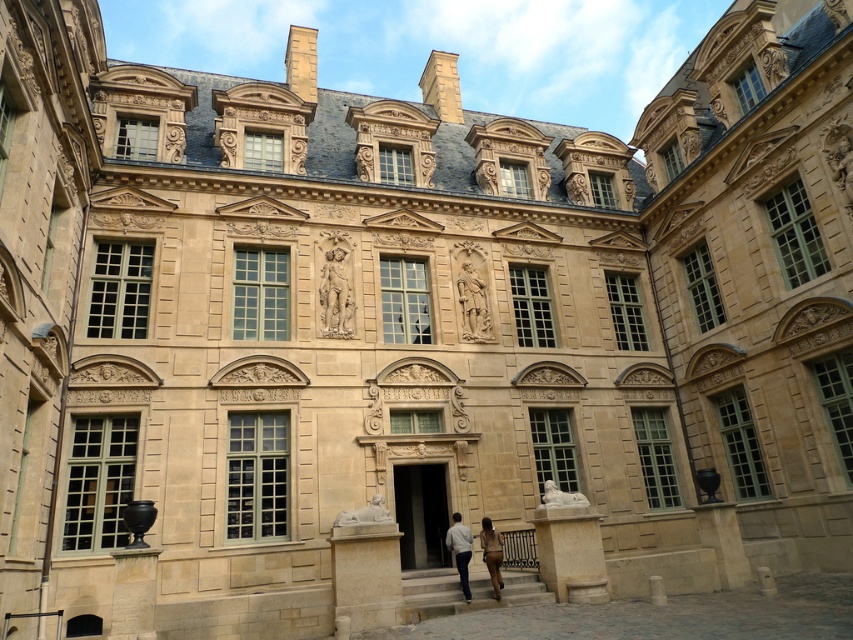
You are an artist standing in front of the grand historical building. You notice a white cotton shirt at center and brown leather pants at center. Which object is shorter?

The white cotton shirt at center is shorter than the brown leather pants at center.

You are standing in front of a historical building with a white cotton shirt at center. Where is the white cotton shirt located in relation to the building?

The white cotton shirt at center is located at point 0.861 on the x axis and 0.540 on the y axis relative to the building.

You are a fashion designer who needs to create a cohesive outfit. You have a white cotton shirt at center and brown leather pants at center in front of you. Given their spatial arrangement, can you determine if they are close enough to be paired together in a coordinated look?

The white cotton shirt at center and brown leather pants at center are 9.69 feet apart from each other. Since the distance between them is significant, they are not positioned close enough to naturally form a coordinated outfit pairing.